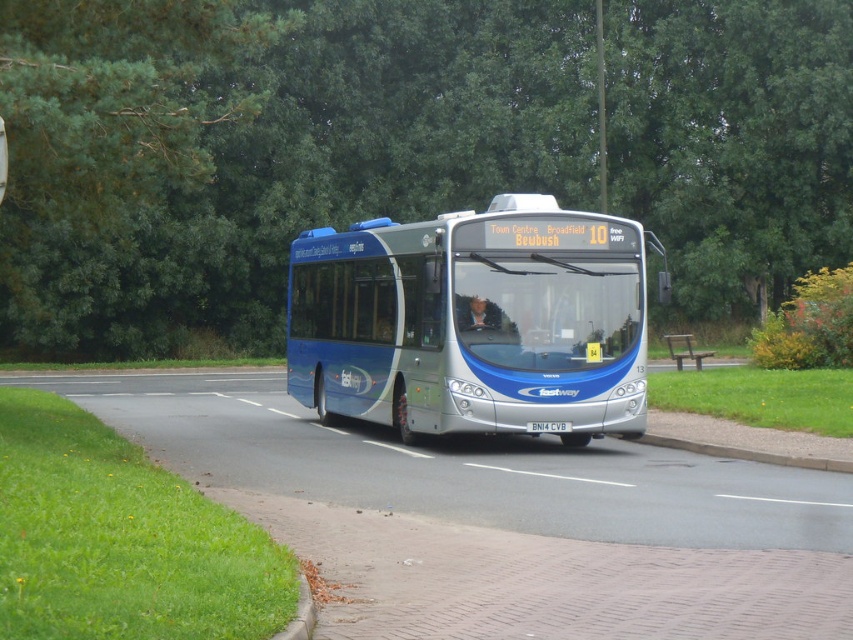
Question: Is matte blue bus at center closer to camera compared to brown wooden bench at lower right?

Choices:
 (A) no
 (B) yes

Answer: (B)

Question: In this image, where is green leafy tree at upper center located relative to matte blue bus at center?

Choices:
 (A) right
 (B) left

Answer: (B)

Question: Can you confirm if matte blue bus at center is wider than brown wooden bench at lower right?

Choices:
 (A) no
 (B) yes

Answer: (B)

Question: Which point is closer to the camera taking this photo?

Choices:
 (A) (804, 22)
 (B) (335, 317)

Answer: (B)

Question: Estimate the real-world distances between objects in this image. Which object is closer to the brown wooden bench at lower right?

Choices:
 (A) green leafy tree at upper center
 (B) matte blue bus at center

Answer: (B)

Question: Which of the following is the farthest from the observer?

Choices:
 (A) (67, 166)
 (B) (670, 339)
 (C) (576, 410)

Answer: (B)